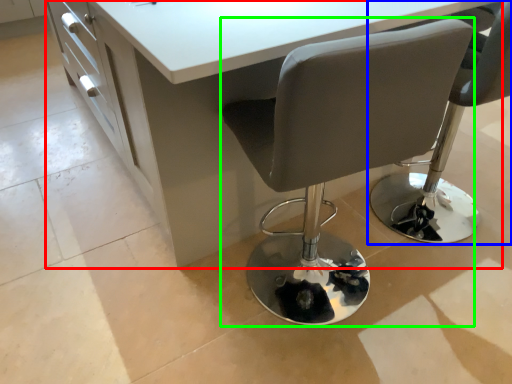
Question: Which is nearer to the table (highlighted by a red box)? chair (highlighted by a blue box) or chair (highlighted by a green box).

Choices:
 (A) chair
 (B) chair

Answer: (B)